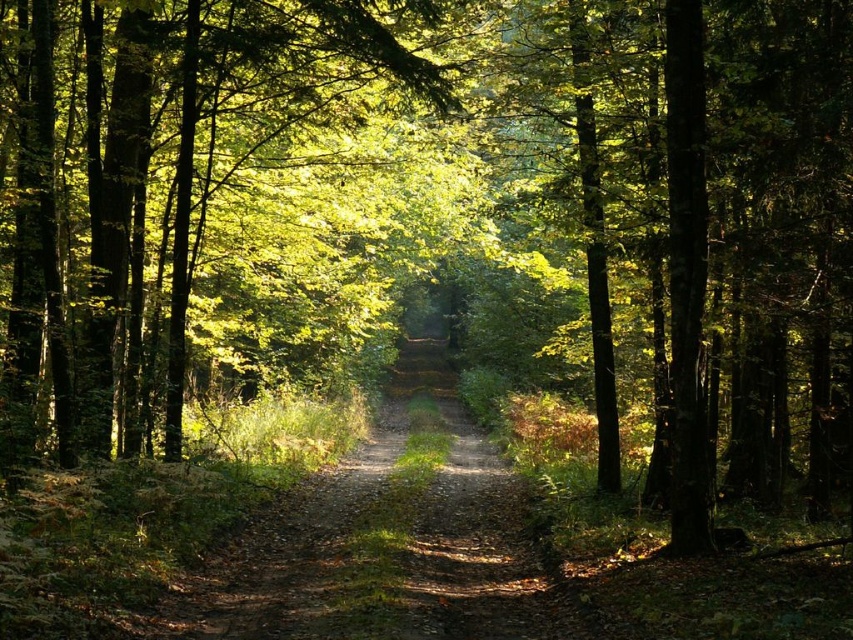
You are a hiker trying to stay on the dirt path at center while avoiding obstacles. There is a green leafy tree at center blocking your way. Can you walk around it without leaving the path?

The green leafy tree at center is larger in size than dirt path at center, so the path may be too narrow to go around the tree without stepping off the path.

You are standing at the entrance of the forest path and want to reach a clearing ahead. There is a green leafy tree at center blocking your direct path. Can you walk around it on the left side?

The green leafy tree at center is located at point [192,186], so you can walk around it on the left side as there is space available.

Looking at this image, you are a hiker standing on the dirt path at center. You want to take a photo of the green leafy tree at center. To ensure the entire tree fits in the frame, should you stand closer to or farther away from the tree?

The green leafy tree at center is taller than the dirt path at center. Since the tree is tall, you should stand farther away from the tree to ensure the entire tree fits in the frame.